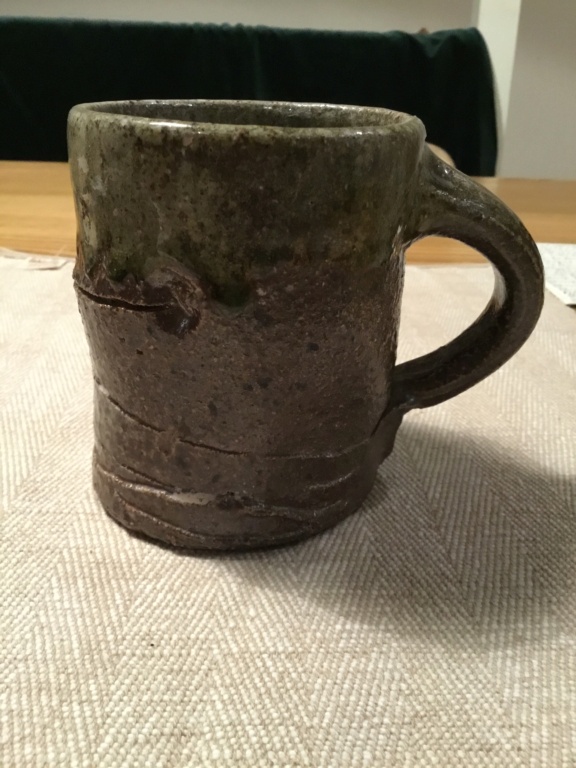
The width and height of the screenshot is (576, 768). In order to click on mug in this screenshot , I will do `click(319, 384)`.